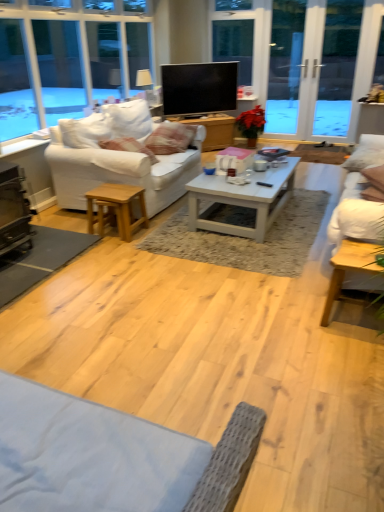
The image size is (384, 512). What do you see at coordinates (127, 146) in the screenshot?
I see `white cotton pillow at center, acting as the first pillow starting from the left` at bounding box center [127, 146].

Find the location of `light brown wood stool at lower left, marked as the 2th table in a back-to-front arrangement`. light brown wood stool at lower left, marked as the 2th table in a back-to-front arrangement is located at coordinates (116, 208).

This screenshot has height=512, width=384. Find the location of `white fabric pillow at right, positioned as the 1th pillow in right-to-left order`. white fabric pillow at right, positioned as the 1th pillow in right-to-left order is located at coordinates (366, 153).

Where is `white fabric couch at left, placed as the second studio couch when sorted from right to left`? white fabric couch at left, placed as the second studio couch when sorted from right to left is located at coordinates (118, 158).

In terms of size, does transparent glass screen door at upper right, acting as the second screen door starting from the right, appear bigger or smaller than white fabric pillow at right, which appears as the 2th pillow when viewed from the left?

In the image, transparent glass screen door at upper right, acting as the second screen door starting from the right, appears to be larger than white fabric pillow at right, which appears as the 2th pillow when viewed from the left.

Is transparent glass screen door at upper right, the 1th screen door from the left, situated inside white fabric pillow at right, positioned as the 1th pillow in right-to-left order, or outside?

transparent glass screen door at upper right, the 1th screen door from the left, lies outside white fabric pillow at right, positioned as the 1th pillow in right-to-left order.

From a real-world perspective, is transparent glass screen door at upper right, acting as the second screen door starting from the right, on top of white fabric pillow at right, positioned as the 1th pillow in right-to-left order?

Indeed, from a real-world perspective, transparent glass screen door at upper right, acting as the second screen door starting from the right, stands above white fabric pillow at right, positioned as the 1th pillow in right-to-left order.

Is transparent glass screen door at upper right, the 1th screen door from the left, in front of or behind white fabric pillow at right, which appears as the 2th pillow when viewed from the left, in the image?

Visually, transparent glass screen door at upper right, the 1th screen door from the left, is located behind white fabric pillow at right, which appears as the 2th pillow when viewed from the left.

Is white fabric pillow at right, which appears as the 2th pillow when viewed from the left, positioned with its back to black metal fireplace at lower left?

No, white fabric pillow at right, which appears as the 2th pillow when viewed from the left, is not facing away from black metal fireplace at lower left.

Considering the relative sizes of white fabric pillow at right, which appears as the 2th pillow when viewed from the left, and black metal fireplace at lower left in the image provided, is white fabric pillow at right, which appears as the 2th pillow when viewed from the left, smaller than black metal fireplace at lower left?

Actually, white fabric pillow at right, which appears as the 2th pillow when viewed from the left, might be larger than black metal fireplace at lower left.

Is white fabric pillow at right, positioned as the 1th pillow in right-to-left order, to the right of black metal fireplace at lower left from the viewer's perspective?

Yes.

From the image's perspective, is white fabric pillow at right, positioned as the 1th pillow in right-to-left order, located above or below black metal fireplace at lower left?

white fabric pillow at right, positioned as the 1th pillow in right-to-left order, is above black metal fireplace at lower left.

From a real-world perspective, is white painted wood coffee table at center, the 1th coffee table viewed from the back, physically below white fabric pillow at right, which appears as the 2th pillow when viewed from the left?

Yes.

Considering the positions of points (295, 163) and (373, 136), is point (295, 163) farther from camera compared to point (373, 136)?

No, (295, 163) is closer to viewer.

In terms of height, does white painted wood coffee table at center, the second coffee table from the front, look taller or shorter compared to white fabric pillow at right, which appears as the 2th pillow when viewed from the left?

In the image, white painted wood coffee table at center, the second coffee table from the front, appears to be taller than white fabric pillow at right, which appears as the 2th pillow when viewed from the left.

What's the angular difference between white painted wood coffee table at center, the second coffee table from the front, and white fabric pillow at right, positioned as the 1th pillow in right-to-left order,'s facing directions?

102 degrees.

Which of these two, transparent glass screen door at upper right, the 1th screen door from the left, or white fabric couch at right, which is counted as the 1th studio couch, starting from the right, is bigger?

With larger size is white fabric couch at right, which is counted as the 1th studio couch, starting from the right.

Considering the points (281, 92) and (379, 161), which point is behind, point (281, 92) or point (379, 161)?

The point (281, 92) is more distant.

Which is more to the right, transparent glass screen door at upper right, the 1th screen door from the left, or white fabric couch at right, which is counted as the 1th studio couch, starting from the right?

Positioned to the right is white fabric couch at right, which is counted as the 1th studio couch, starting from the right.

Image resolution: width=384 pixels, height=512 pixels. I want to click on studio couch that appears on the right of transparent glass screen door at upper right, acting as the second screen door starting from the right, so click(x=361, y=196).

Considering the sizes of objects black metal fireplace at lower left and white painted wood coffee table at center, acting as the 2th coffee table starting from the bottom, in the image provided, who is thinner, black metal fireplace at lower left or white painted wood coffee table at center, acting as the 2th coffee table starting from the bottom,?

Thinner between the two is black metal fireplace at lower left.

Which is behind, point (10, 205) or point (235, 188)?

Positioned behind is point (235, 188).

Do you think black metal fireplace at lower left is within white painted wood coffee table at center, which is the first coffee table from top to bottom, or outside of it?

black metal fireplace at lower left cannot be found inside white painted wood coffee table at center, which is the first coffee table from top to bottom.

Which is behind, white painted wood coffee table at center, which is the second table in left-to-right order, or transparent glass screen door at upper right, which appears as the 1th screen door when viewed from the right?

white painted wood coffee table at center, which is the second table in left-to-right order, is further from the camera.

From the image's perspective, who appears lower, white painted wood coffee table at center, the 2th table from the front, or transparent glass screen door at upper right, which appears as the 1th screen door when viewed from the right?

white painted wood coffee table at center, the 2th table from the front, from the image's perspective.

Are white painted wood coffee table at center, which is the second table in left-to-right order, and transparent glass screen door at upper right, which is counted as the second screen door, starting from the left, beside each other?

No.

From the image's perspective, is flat screen tv at center above or below light brown wood stool at lower left, arranged as the second table when viewed from the top?

Based on their image positions, flat screen tv at center is located above light brown wood stool at lower left, arranged as the second table when viewed from the top.

Can you confirm if flat screen tv at center is bigger than light brown wood stool at lower left, the first table when ordered from left to right?

Yes.

Looking at this image, can you tell me how much flat screen tv at center and light brown wood stool at lower left, arranged as the second table when viewed from the top, differ in facing direction?

The facing directions of flat screen tv at center and light brown wood stool at lower left, arranged as the second table when viewed from the top, are 48.1 degrees apart.

Between flat screen tv at center and light brown wood stool at lower left, the 1th table positioned from the bottom, which one is positioned in front?

light brown wood stool at lower left, the 1th table positioned from the bottom, is more forward.

From a real-world perspective, which screen door is the 2nd one above the white fabric pillow at right, positioned as the 1th pillow in right-to-left order? Please provide its 2D coordinates.

[(285, 66)]

The height and width of the screenshot is (512, 384). I want to click on the 1st pillow positioned above the black metal fireplace at lower left (from the image's perspective), so click(366, 153).

Estimate the real-world distances between objects in this image. Which object is closer to white painted wood coffee table at center, acting as the 2th coffee table starting from the bottom, white fabric pillow at right, which appears as the 2th pillow when viewed from the left, or transparent glass screen door at upper right, the 1th screen door from the left?

white fabric pillow at right, which appears as the 2th pillow when viewed from the left, lies closer to white painted wood coffee table at center, acting as the 2th coffee table starting from the bottom, than the other object.

Looking at the image, which one is located further to flat screen tv at center, white painted wood coffee table at center, the 1th coffee table viewed from the back, or white fabric couch at left, which is counted as the 1th studio couch, starting from the left?

Based on the image, white painted wood coffee table at center, the 1th coffee table viewed from the back, appears to be further to flat screen tv at center.

When comparing their distances from white cotton pillow at center, which appears as the 2th pillow when viewed from the right, does white painted wood coffee table at center, which is the first coffee table from top to bottom, or black metal fireplace at lower left seem further?

Among the two, white painted wood coffee table at center, which is the first coffee table from top to bottom, is located further to white cotton pillow at center, which appears as the 2th pillow when viewed from the right.

Considering their positions, is flat screen tv at center positioned closer to white fabric pillow at right, which appears as the 2th pillow when viewed from the left, than light brown wooden coffee table at center, acting as the 1th coffee table starting from the bottom?

light brown wooden coffee table at center, acting as the 1th coffee table starting from the bottom, is closer to white fabric pillow at right, which appears as the 2th pillow when viewed from the left.

From the image, which object appears to be farther from flat screen tv at center, black metal fireplace at lower left or green matte poinsettia at center?

Among the two, black metal fireplace at lower left is located further to flat screen tv at center.

Which object lies nearer to the anchor point white fabric couch at right, which appears as the 2th studio couch when viewed from the left, white painted wood coffee table at center, acting as the 2th coffee table starting from the bottom, or white cotton pillow at center, which appears as the 2th pillow when viewed from the right?

The object closer to white fabric couch at right, which appears as the 2th studio couch when viewed from the left, is white painted wood coffee table at center, acting as the 2th coffee table starting from the bottom.

When comparing their distances from white painted wood coffee table at center, which ranks as the first table in back-to-front order, does green matte poinsettia at center or white fabric couch at left, placed as the second studio couch when sorted from right to left, seem further?

white fabric couch at left, placed as the second studio couch when sorted from right to left, lies further to white painted wood coffee table at center, which ranks as the first table in back-to-front order, than the other object.

From the image, which object appears to be farther from light brown wooden coffee table at center, which ranks as the 1th coffee table in front-to-back order, white painted wood coffee table at center, which ranks as the first table in back-to-front order, or transparent glass screen door at upper right, which is counted as the second screen door, starting from the left?

transparent glass screen door at upper right, which is counted as the second screen door, starting from the left, is positioned further to the anchor light brown wooden coffee table at center, which ranks as the 1th coffee table in front-to-back order.

Find the location of `studio couch located between white painted wood coffee table at center, which is the first coffee table from top to bottom, and transparent glass screen door at upper right, the 1th screen door from the left, in the depth direction`. studio couch located between white painted wood coffee table at center, which is the first coffee table from top to bottom, and transparent glass screen door at upper right, the 1th screen door from the left, in the depth direction is located at coordinates (118, 158).

This screenshot has width=384, height=512. Identify the location of television between white cotton pillow at center, which appears as the 2th pillow when viewed from the right, and transparent glass screen door at upper right, the 1th screen door from the left, from front to back. (199, 88).

I want to click on coffee table between light brown wooden coffee table at center, the second coffee table from the top, and transparent glass screen door at upper right, acting as the second screen door starting from the right, from front to back, so click(x=242, y=199).

This screenshot has height=512, width=384. Find the location of `television between black metal fireplace at lower left and white fabric pillow at right, which appears as the 2th pillow when viewed from the left`. television between black metal fireplace at lower left and white fabric pillow at right, which appears as the 2th pillow when viewed from the left is located at coordinates (199, 88).